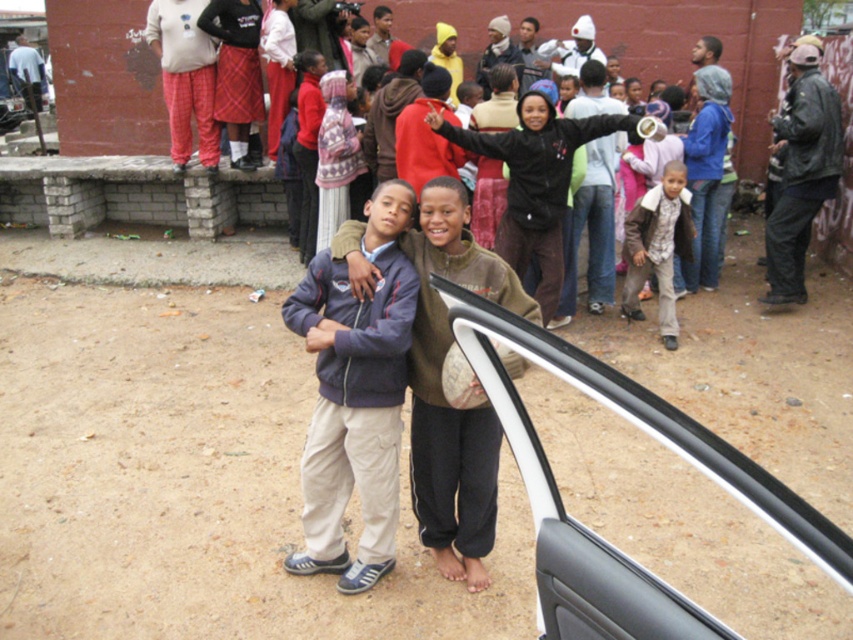
You are a photographer trying to capture a group photo of the people in the scene. You notice the brown fuzzy sweater at center and the plaid skirt at upper center. Which clothing item should you focus on first to ensure it fits well in the frame, considering their sizes?

The brown fuzzy sweater at center is larger than the plaid skirt at upper center, so you should focus on the brown fuzzy sweater at center first to ensure it fits well in the frame.

You are standing at the point labeled point [549,236] and want to walk to the car door. There is an obstacle at point [450,426]. Can you walk around the obstacle to reach the car door?

Point [450,426] is in front of point [549,236], so you cannot walk around the obstacle to reach the car door because the obstacle is blocking your path.